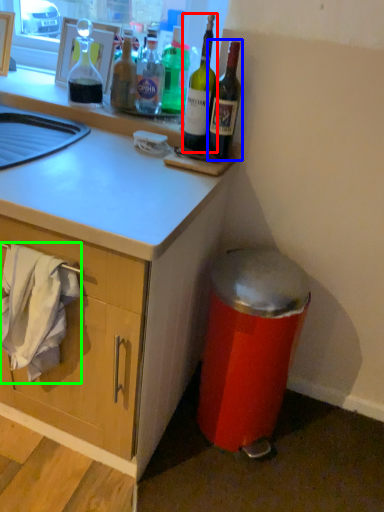
Question: Which is farther away from bottle (highlighted by a red box)? bottle (highlighted by a blue box) or laundry (highlighted by a green box)?

Choices:
 (A) bottle
 (B) laundry

Answer: (B)